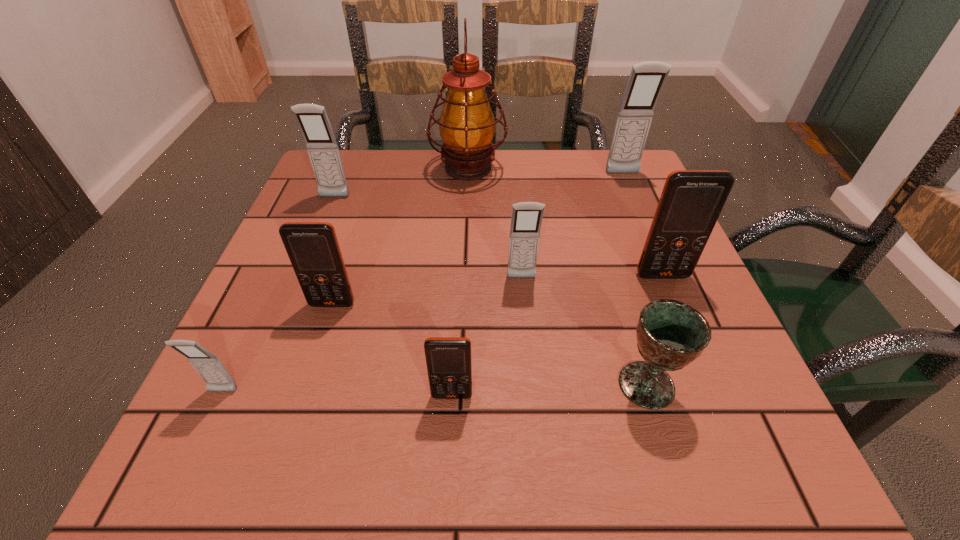
The image size is (960, 540). I want to click on the second biggest orange cellular telephone, so click(x=313, y=249).

In order to click on chalice in this screenshot , I will do `click(670, 334)`.

Find the location of a particular element. This screenshot has height=540, width=960. the fourth cellular telephone from left to right is located at coordinates (448, 359).

Locate an element on the screen. the second orange cellular telephone from left to right is located at coordinates (448, 359).

Locate an element on the screen. This screenshot has height=540, width=960. the nearest gray cellular telephone is located at coordinates (209, 367).

You are a GUI agent. You are given a task and a screenshot of the screen. Output one action in this format:
    pyautogui.click(x=<x>, y=<y>)
    Task: Click on the free spot located 0.060m on the front of the tallest object
    The width and height of the screenshot is (960, 540).
    Given the screenshot: What is the action you would take?
    pyautogui.click(x=467, y=205)

The width and height of the screenshot is (960, 540). Identify the location of vacant space located on the front-facing side of the rightmost gray cellular telephone. (661, 266).

I want to click on vacant space positioned 0.280m on the front-facing side of the second farthest gray cellular telephone, so click(x=297, y=291).

Where is `free space located on the screen of the rightmost orange cellular telephone`? The image size is (960, 540). free space located on the screen of the rightmost orange cellular telephone is located at coordinates pos(701,367).

Identify the location of vacant space located on the front-facing side of the third cellular telephone from right to left. (530, 365).